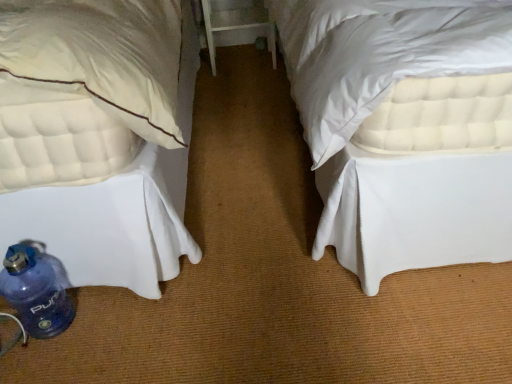
What is the approximate width of blue plastic water bottle at lower left?

blue plastic water bottle at lower left is 6.07 inches wide.

The width and height of the screenshot is (512, 384). Identify the location of blue plastic water bottle at lower left. (37, 290).

From the image's perspective, is blue plastic water bottle at lower left over white wood table at center?

No, from the image's perspective, blue plastic water bottle at lower left is not above white wood table at center.

From a real-world perspective, between blue plastic water bottle at lower left and white wood table at center, who is vertically lower?

In real-world perspective, blue plastic water bottle at lower left is lower.

Which object is positioned more to the right, blue plastic water bottle at lower left or white wood table at center?

white wood table at center.

Does point (42, 246) appear closer or farther from the camera than point (209, 36)?

Point (42, 246) is positioned closer to the camera compared to point (209, 36).

From the picture: From a real-world perspective, is white quilted mattress at lower left located higher than white wood table at center?

Yes.

Image resolution: width=512 pixels, height=384 pixels. Find the location of `bed above the white wood table at center (from a real-world perspective)`. bed above the white wood table at center (from a real-world perspective) is located at coordinates (111, 224).

From the image's perspective, is white quilted mattress at lower left over white wood table at center?

No, from the image's perspective, white quilted mattress at lower left is not above white wood table at center.

Is white quilted mattress at lower left aimed at white wood table at center?

No.

Which is further, [29,266] or [189,93]?

Positioned behind is point [189,93].

From a real-world perspective, does blue plastic water bottle at lower left sit lower than white quilted mattress at lower left?

Correct, in the physical world, blue plastic water bottle at lower left is lower than white quilted mattress at lower left.

Considering the relative sizes of blue plastic water bottle at lower left and white quilted mattress at lower left in the image provided, is blue plastic water bottle at lower left smaller than white quilted mattress at lower left?

Correct, blue plastic water bottle at lower left occupies less space than white quilted mattress at lower left.

From the picture: Is white wood table at center taller than blue plastic water bottle at lower left?

Indeed, white wood table at center has a greater height compared to blue plastic water bottle at lower left.

Is blue plastic water bottle at lower left at the back of white wood table at center?

No, white wood table at center is not facing the opposite direction of blue plastic water bottle at lower left.

Does point (240, 25) come closer to viewer compared to point (60, 320)?

No.

At what (x,y) coordinates should I click in order to perform the action: click on bottle on the right of white quilted mattress at lower left. Please return your answer as a coordinate pair (x, y). This screenshot has width=512, height=384. Looking at the image, I should click on (37, 290).

Does white quilted mattress at lower left lie in front of blue plastic water bottle at lower left?

Yes, the depth of white quilted mattress at lower left is less than that of blue plastic water bottle at lower left.

Which of these two, white quilted mattress at lower left or blue plastic water bottle at lower left, is smaller?

blue plastic water bottle at lower left is smaller.

From a real-world perspective, is white quilted mattress at lower left under blue plastic water bottle at lower left?

No.

Based on the photo, from a real-world perspective, between white wood table at center and white quilted mattress at lower left, who is vertically lower?

white wood table at center.

Is the depth of white wood table at center greater than that of white quilted mattress at lower left?

Yes, white wood table at center is behind white quilted mattress at lower left.

Considering the relative sizes of white wood table at center and white quilted mattress at lower left in the image provided, is white wood table at center bigger than white quilted mattress at lower left?

Incorrect, white wood table at center is not larger than white quilted mattress at lower left.

Considering the points (249, 13) and (156, 250), which point is in front, point (249, 13) or point (156, 250)?

Positioned in front is point (156, 250).

I want to click on table on the right of the blue plastic water bottle at lower left, so click(234, 29).

Find the location of a particular element. Image resolution: width=512 pixels, height=384 pixels. table that appears below the white quilted mattress at lower left (from a real-world perspective) is located at coordinates (234, 29).

Considering their positions, is white quilted mattress at lower left positioned further to blue plastic water bottle at lower left than white wood table at center?

Among the two, white wood table at center is located further to blue plastic water bottle at lower left.

Which object lies nearer to the anchor point blue plastic water bottle at lower left, white wood table at center or white quilted mattress at lower left?

white quilted mattress at lower left.

From the image, which object appears to be nearer to white wood table at center, blue plastic water bottle at lower left or white quilted mattress at lower left?

white quilted mattress at lower left lies closer to white wood table at center than the other object.

From the image, which object appears to be farther from white quilted mattress at lower left, white wood table at center or blue plastic water bottle at lower left?

white wood table at center lies further to white quilted mattress at lower left than the other object.

Considering their positions, is white quilted mattress at lower left positioned further to white wood table at center than blue plastic water bottle at lower left?

Based on the image, blue plastic water bottle at lower left appears to be further to white wood table at center.

Estimate the real-world distances between objects in this image. Which object is closer to white quilted mattress at lower left, blue plastic water bottle at lower left or white wood table at center?

The object closer to white quilted mattress at lower left is blue plastic water bottle at lower left.

At what (x,y) coordinates should I click in order to perform the action: click on bottle between white quilted mattress at lower left and white wood table at center in the front-back direction. Please return your answer as a coordinate pair (x, y). The width and height of the screenshot is (512, 384). Looking at the image, I should click on (37, 290).